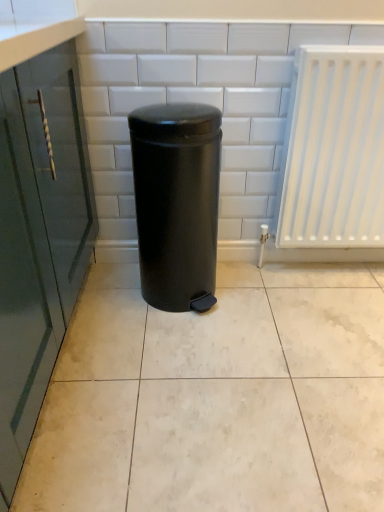
What is the approximate width of black matte waste container at center?

14.27 inches.

What do you see at coordinates (217, 397) in the screenshot? I see `white glossy ceramic tile at center` at bounding box center [217, 397].

I want to click on black matte waste container at center, so click(x=177, y=202).

Is white plastic radiator at right next to white glossy ceramic tile at center?

white plastic radiator at right is not next to white glossy ceramic tile at center, and they're not touching.

Considering the relative positions of white plastic radiator at right and white glossy ceramic tile at center in the image provided, is white plastic radiator at right to the left of white glossy ceramic tile at center from the viewer's perspective?

In fact, white plastic radiator at right is to the right of white glossy ceramic tile at center.

Which is behind, point (284, 238) or point (139, 477)?

The point (284, 238) is farther from the camera.

From the image's perspective, relative to black matte waste container at center, is white glossy ceramic tile at center above or below?

Clearly, from the image's perspective, white glossy ceramic tile at center is below black matte waste container at center.

Identify the location of waste container that appears above the white glossy ceramic tile at center (from the image's perspective). (177, 202).

Can you confirm if white glossy ceramic tile at center is bigger than black matte waste container at center?

Yes.

Is white glossy ceramic tile at center facing away from white plastic radiator at right?

That's not correct — white glossy ceramic tile at center is not looking away from white plastic radiator at right.

From the picture: Considering the positions of objects white glossy ceramic tile at center and white plastic radiator at right in the image provided, who is in front, white glossy ceramic tile at center or white plastic radiator at right?

white glossy ceramic tile at center.

From the image's perspective, which one is positioned lower, white glossy ceramic tile at center or white plastic radiator at right?

From the image's view, white glossy ceramic tile at center is below.

Would you say white plastic radiator at right is part of white glossy ceramic tile at center's contents?

No, white glossy ceramic tile at center does not contain white plastic radiator at right.

How distant is black matte waste container at center from white glossy ceramic tile at center?

black matte waste container at center and white glossy ceramic tile at center are 16.38 inches apart from each other.

Are black matte waste container at center and white glossy ceramic tile at center beside each other?

black matte waste container at center and white glossy ceramic tile at center are not in contact.

From a real-world perspective, is black matte waste container at center positioned above or below white glossy ceramic tile at center?

Clearly, from a real-world perspective, black matte waste container at center is above white glossy ceramic tile at center.

Considering the sizes of objects black matte waste container at center and white glossy ceramic tile at center in the image provided, who is thinner, black matte waste container at center or white glossy ceramic tile at center?

black matte waste container at center.

Considering the sizes of white plastic radiator at right and black matte waste container at center in the image, is white plastic radiator at right taller or shorter than black matte waste container at center?

Clearly, white plastic radiator at right is taller compared to black matte waste container at center.

From a real-world perspective, does white plastic radiator at right sit lower than black matte waste container at center?

Incorrect, from a real-world perspective, white plastic radiator at right is higher than black matte waste container at center.

From the image's perspective, is white plastic radiator at right below black matte waste container at center?

No, from the image's perspective, white plastic radiator at right is not below black matte waste container at center.

Which is farther from the camera, (190,249) or (310,236)?

The point (310,236) is behind.

From a real-world perspective, is black matte waste container at center positioned above or below white plastic radiator at right?

From a real-world perspective, black matte waste container at center is physically below white plastic radiator at right.

Considering the sizes of objects black matte waste container at center and white plastic radiator at right in the image provided, who is wider, black matte waste container at center or white plastic radiator at right?

black matte waste container at center.

Identify the location of radiator above the white glossy ceramic tile at center (from the image's perspective). (333, 150).

Image resolution: width=384 pixels, height=512 pixels. I want to click on waste container that appears on the left of white glossy ceramic tile at center, so click(x=177, y=202).

Considering their positions, is black matte waste container at center positioned further to white plastic radiator at right than white glossy ceramic tile at center?

white glossy ceramic tile at center.

Which object lies further to the anchor point white glossy ceramic tile at center, white plastic radiator at right or black matte waste container at center?

white plastic radiator at right.

From the image, which object appears to be nearer to white glossy ceramic tile at center, black matte waste container at center or white plastic radiator at right?

black matte waste container at center is closer to white glossy ceramic tile at center.

When comparing their distances from black matte waste container at center, does white plastic radiator at right or white glossy ceramic tile at center seem closer?

white glossy ceramic tile at center is positioned closer to the anchor black matte waste container at center.

When comparing their distances from black matte waste container at center, does white glossy ceramic tile at center or white plastic radiator at right seem further?

white plastic radiator at right is positioned further to the anchor black matte waste container at center.

Looking at the image, which one is located further to white plastic radiator at right, white glossy ceramic tile at center or black matte waste container at center?

The object further to white plastic radiator at right is white glossy ceramic tile at center.

Where is `waste container between white plastic radiator at right and white glossy ceramic tile at center from top to bottom`? The image size is (384, 512). waste container between white plastic radiator at right and white glossy ceramic tile at center from top to bottom is located at coordinates (177, 202).